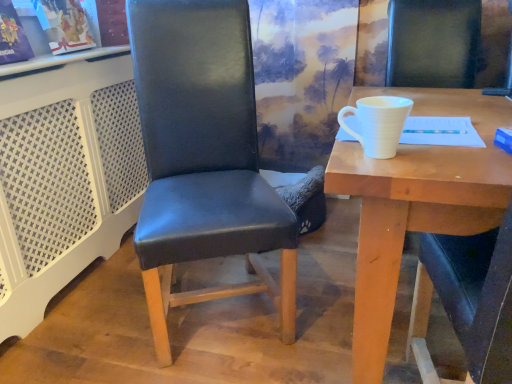
Locate an element on the screen. empty space that is ontop of white matte cup at upper right (from a real-world perspective) is located at coordinates (462, 115).